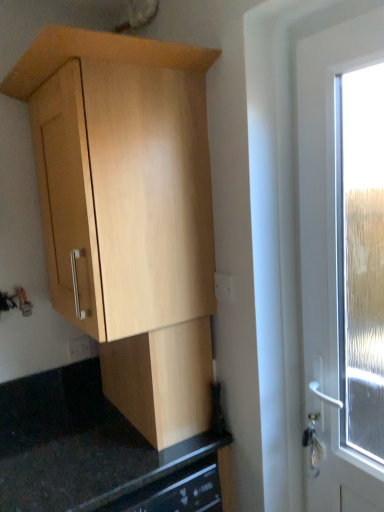
I want to click on vacant point above black granite countertop at lower center (from a real-world perspective), so click(x=111, y=452).